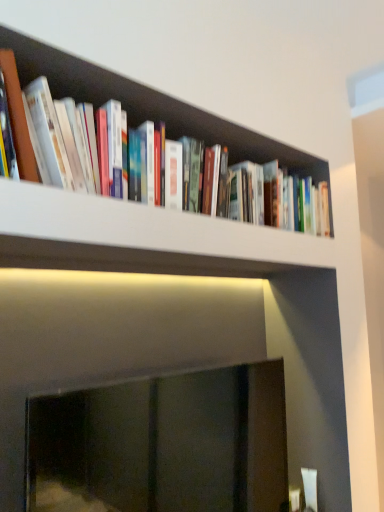
Question: From the image's perspective, is hardcover books at upper center positioned above or below black glass fireplace at center?

Choices:
 (A) below
 (B) above

Answer: (B)

Question: From a real-world perspective, relative to black glass fireplace at center, is hardcover books at upper center vertically above or below?

Choices:
 (A) above
 (B) below

Answer: (A)

Question: Is hardcover books at upper center in front of or behind black glass fireplace at center in the image?

Choices:
 (A) behind
 (B) front

Answer: (A)

Question: From a real-world perspective, is black glass fireplace at center above or below hardcover books at upper center?

Choices:
 (A) above
 (B) below

Answer: (B)

Question: In terms of width, does black glass fireplace at center look wider or thinner when compared to hardcover books at upper center?

Choices:
 (A) wide
 (B) thin

Answer: (B)

Question: From the image's perspective, relative to hardcover books at upper center, is black glass fireplace at center above or below?

Choices:
 (A) below
 (B) above

Answer: (A)

Question: In terms of height, does black glass fireplace at center look taller or shorter compared to hardcover books at upper center?

Choices:
 (A) tall
 (B) short

Answer: (A)